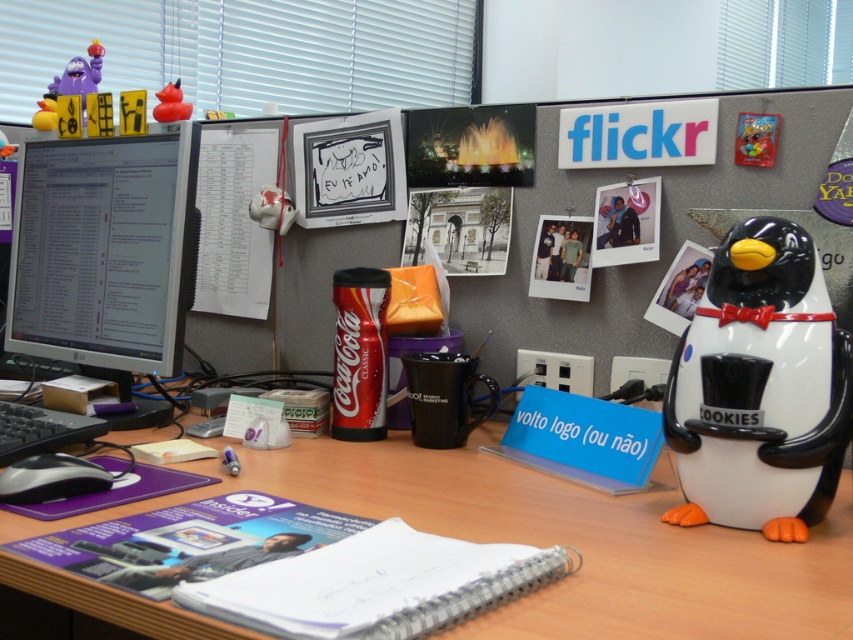
Does wooden at center come in front of white glossy penguin cookies jar at right?

That is True.

Between point (170, 429) and point (767, 372), which one is positioned in front?

Point (767, 372)

This screenshot has height=640, width=853. I want to click on wooden at center, so click(555, 540).

Looking at this image, does matte black monitor at left have a greater width compared to rubber duck at upper left?

Correct, the width of matte black monitor at left exceeds that of rubber duck at upper left.

Looking at this image, can you confirm if matte black monitor at left is thinner than rubber duck at upper left?

Incorrect, matte black monitor at left's width is not less than rubber duck at upper left's.

Image resolution: width=853 pixels, height=640 pixels. I want to click on matte black monitor at left, so click(x=105, y=252).

Find the location of a particular element. Image resolution: width=853 pixels, height=640 pixels. matte black monitor at left is located at coordinates (105, 252).

Is white glossy penguin cookies jar at right smaller than matte black monitor at left?

Correct, white glossy penguin cookies jar at right occupies less space than matte black monitor at left.

Is white glossy penguin cookies jar at right to the right of matte black monitor at left from the viewer's perspective?

Yes, white glossy penguin cookies jar at right is to the right of matte black monitor at left.

Is point (697, 492) positioned after point (158, 404)?

No, it is not.

Locate an element on the screen. white glossy penguin cookies jar at right is located at coordinates (759, 387).